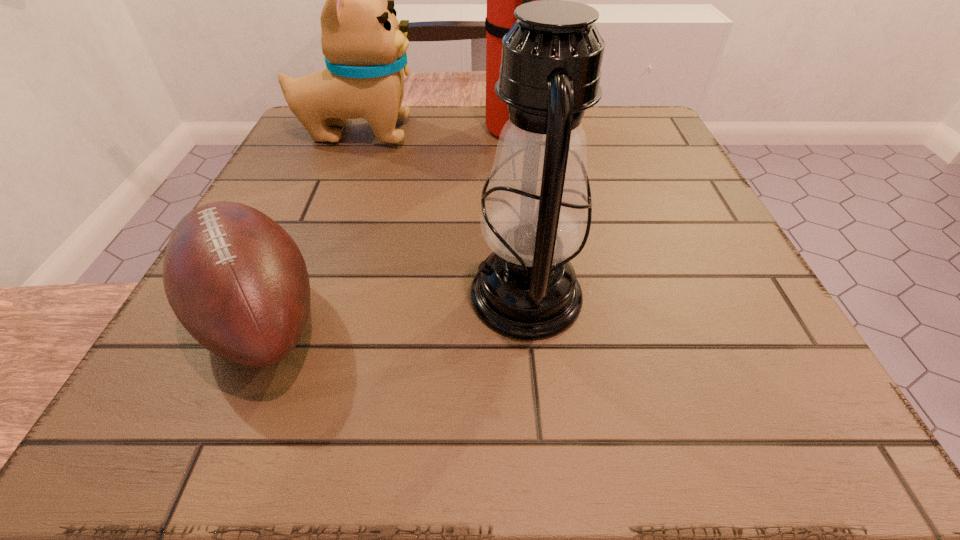
In the image, there is a desktop. Where is `vacant space at the right edge`? vacant space at the right edge is located at coordinates (671, 222).

Image resolution: width=960 pixels, height=540 pixels. Find the location of `vacant space at the near left corner of the desktop`. vacant space at the near left corner of the desktop is located at coordinates (156, 404).

The width and height of the screenshot is (960, 540). Identify the location of vacant area at the far right corner. (658, 157).

You are a GUI agent. You are given a task and a screenshot of the screen. Output one action in this format:
    pyautogui.click(x=<x>, y=<y>)
    Task: Click on the vacant area at the near right corner
    This screenshot has height=540, width=960.
    Given the screenshot: What is the action you would take?
    pyautogui.click(x=722, y=440)

Find the location of a particular element. The height and width of the screenshot is (540, 960). vacant area that lies between the puppy and the fire extinguisher is located at coordinates (437, 131).

The image size is (960, 540). I want to click on free space between the shortest object and the oil lamp, so pyautogui.click(x=394, y=306).

Locate an element on the screen. The height and width of the screenshot is (540, 960). vacant space in between the puppy and the shortest object is located at coordinates [x=309, y=224].

The height and width of the screenshot is (540, 960). I want to click on vacant point located between the football (American) and the puppy, so click(x=309, y=224).

I want to click on free spot between the puppy and the tallest object, so click(437, 131).

Find the location of a particular element. This screenshot has height=540, width=960. vacant area between the tallest object and the puppy is located at coordinates tap(437, 131).